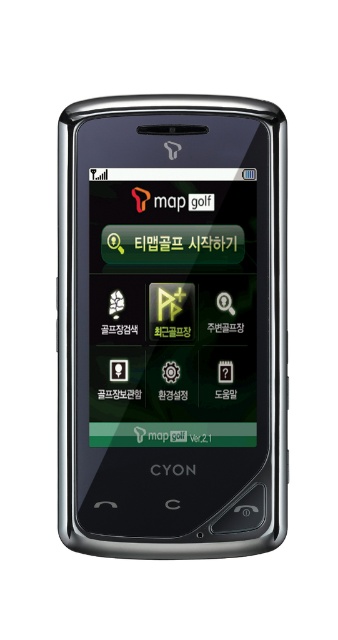
Between satin black smartphone at center and matte black screen at center, which one appears on the left side from the viewer's perspective?

satin black smartphone at center

Does point (148, 202) come in front of point (223, 378)?

That is False.

At what (x,y) coordinates should I click in order to perform the action: click on satin black smartphone at center. Please return your answer as a coordinate pair (x, y). Looking at the image, I should click on (172, 326).